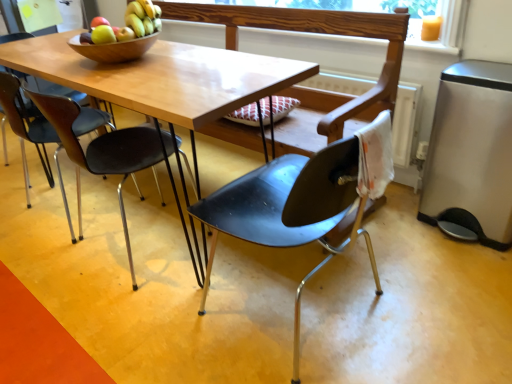
You are a GUI agent. You are given a task and a screenshot of the screen. Output one action in this format:
    pyautogui.click(x=<x>, y=<y>)
    Task: Click on the free space that is to the left of stainless steel trash can at right
    The image size is (512, 384).
    Given the screenshot: What is the action you would take?
    pyautogui.click(x=404, y=231)